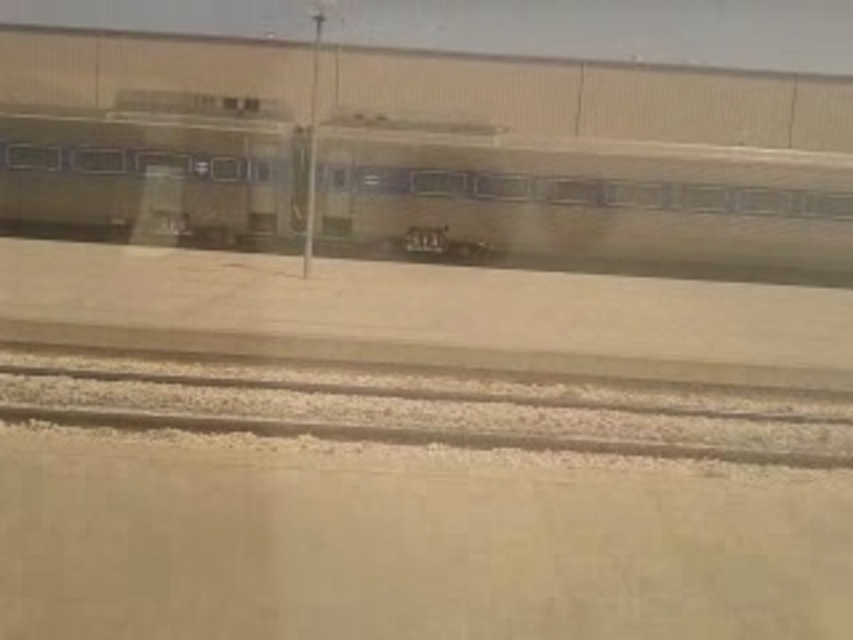
Question: Does green matte train at center have a larger size compared to gray gravel track at bottom?

Choices:
 (A) yes
 (B) no

Answer: (A)

Question: Can you confirm if green matte train at center is smaller than gray gravel track at bottom?

Choices:
 (A) no
 (B) yes

Answer: (A)

Question: Does green matte train at center have a lesser width compared to gray gravel track at bottom?

Choices:
 (A) yes
 (B) no

Answer: (B)

Question: Which object is farther from the camera taking this photo?

Choices:
 (A) gray gravel track at bottom
 (B) green matte train at center

Answer: (B)